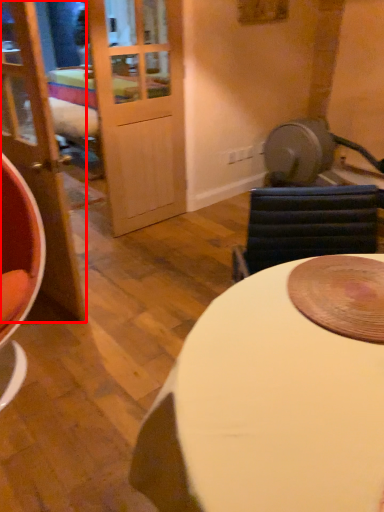
Question: Observing the image, what is the correct spatial positioning of door (annotated by the red box) in reference to table?

Choices:
 (A) right
 (B) left

Answer: (B)